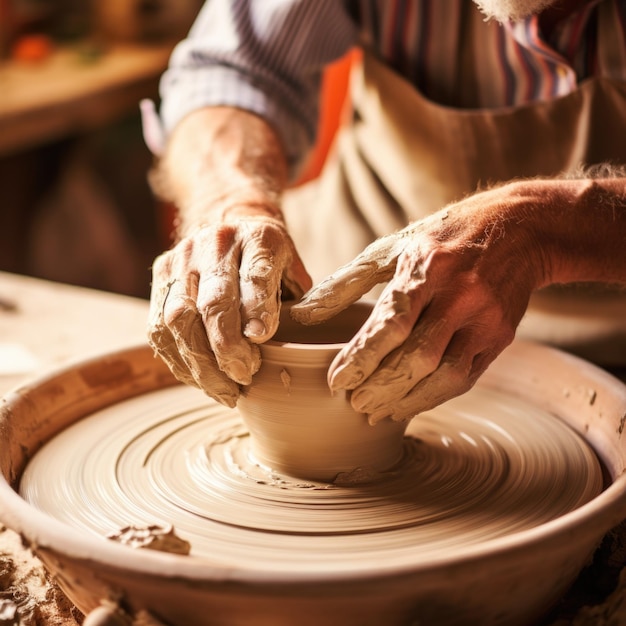
The width and height of the screenshot is (626, 626). What are the coordinates of `table` in the screenshot? It's located at (79, 94), (78, 319).